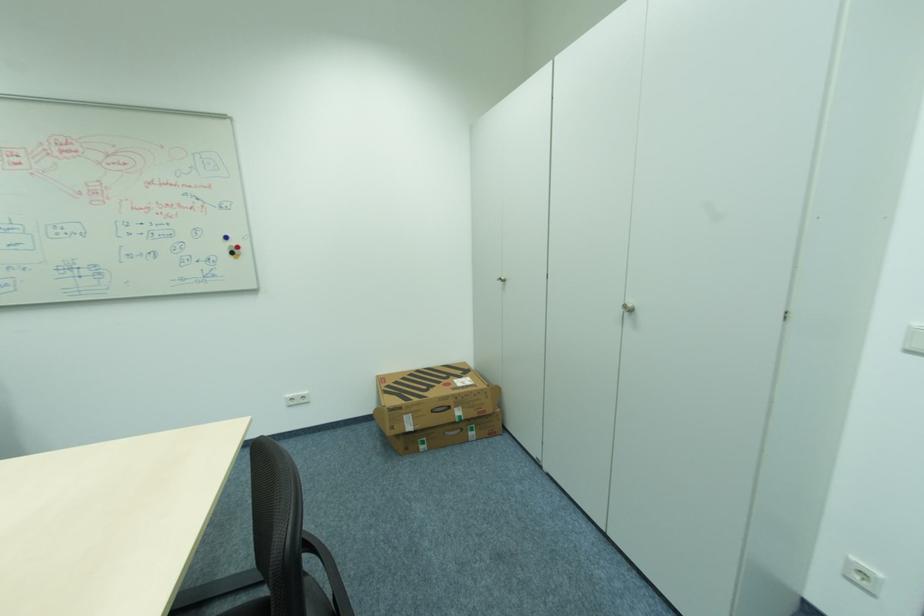
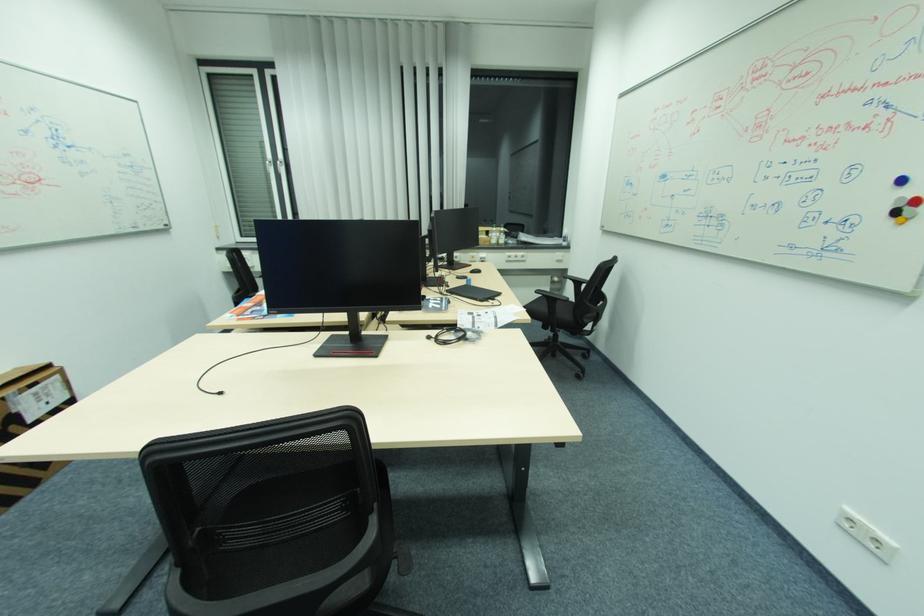
Find the pixel in the second image that matches point 292,399 in the first image.

(848, 511)